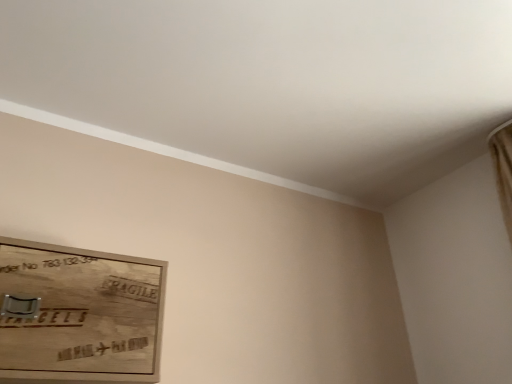
What do you see at coordinates (79, 313) in the screenshot? The height and width of the screenshot is (384, 512). I see `wooden sign at upper left` at bounding box center [79, 313].

This screenshot has height=384, width=512. I want to click on wooden sign at upper left, so click(79, 313).

Where is `wooden sign at upper left`? wooden sign at upper left is located at coordinates (79, 313).